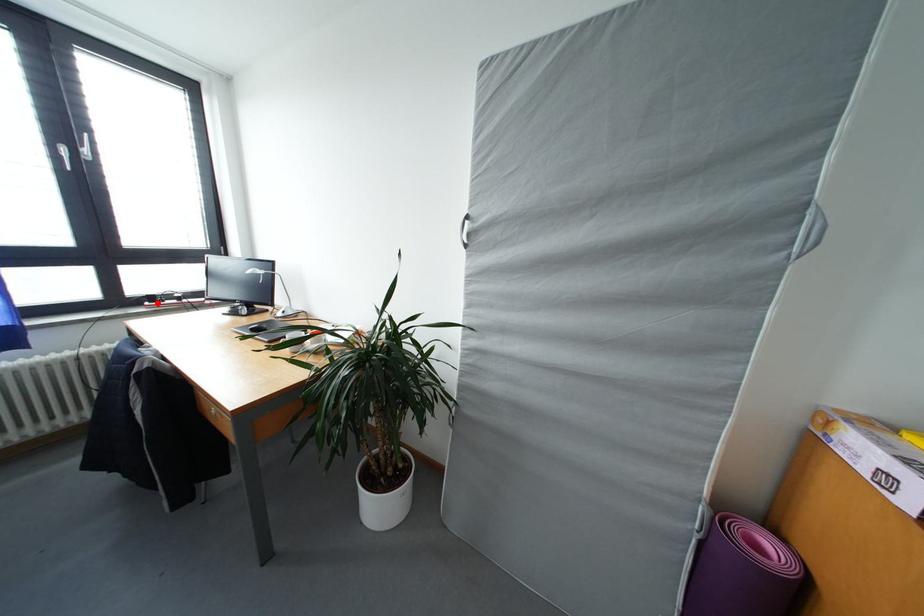
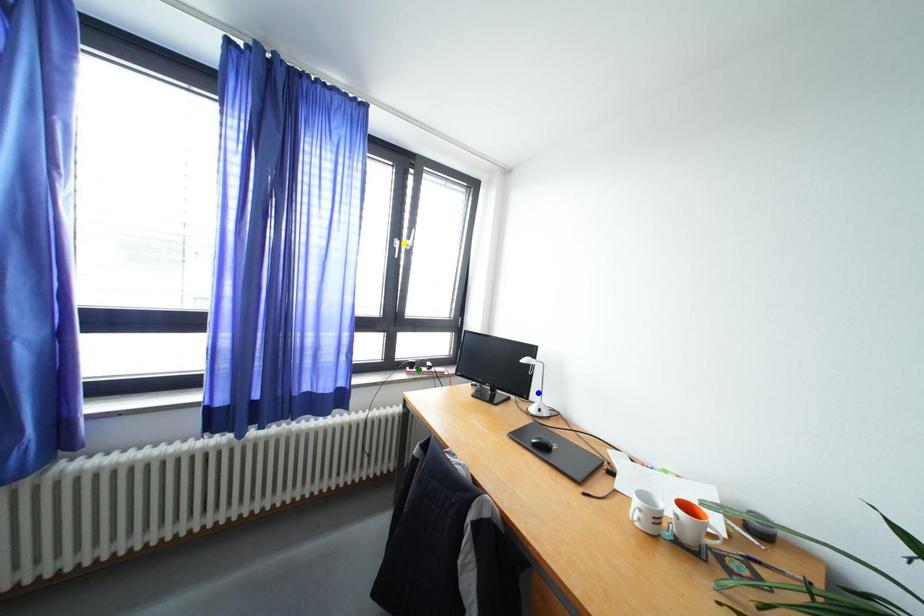
Question: I am providing you with two images of the same scene from different viewpoints. A red point is marked on the first image. You are given multiple points on the second image. Which spot in image 2 lines up with the point in image 1?

Choices:
 (A) green point
 (B) blue point
 (C) yellow point

Answer: (A)